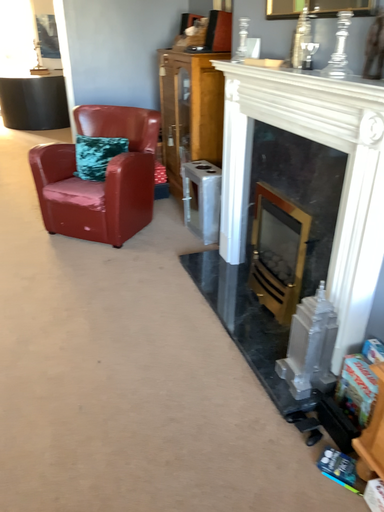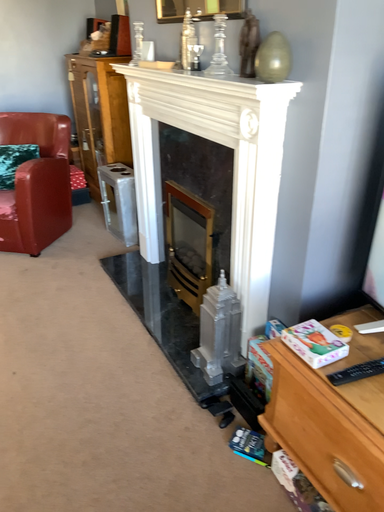
Question: How did the camera likely rotate when shooting the video?

Choices:
 (A) rotated left
 (B) rotated right

Answer: (B)